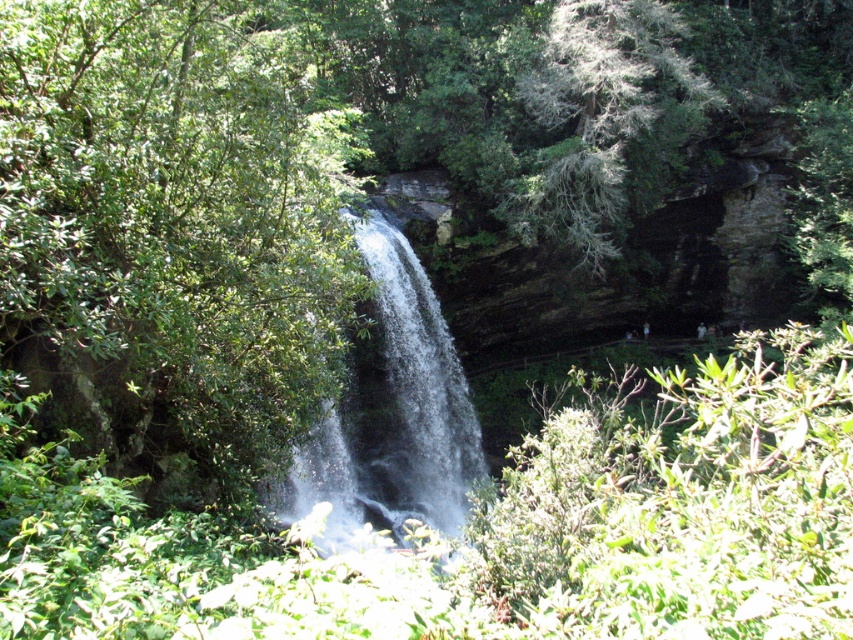
Question: Which point is closer to the camera taking this photo?

Choices:
 (A) (364, 516)
 (B) (170, 228)
 (C) (579, 161)

Answer: (B)

Question: Which of these objects is positioned closest to the green leafy tree at center?

Choices:
 (A) green textured rock at upper center
 (B) clear water at center

Answer: (B)

Question: Which object is the closest to the green textured rock at upper center?

Choices:
 (A) green leafy tree at center
 (B) clear water at center

Answer: (B)

Question: Is green leafy tree at center in front of green textured rock at upper center?

Choices:
 (A) no
 (B) yes

Answer: (B)

Question: Is green leafy tree at center closer to the viewer compared to green textured rock at upper center?

Choices:
 (A) no
 (B) yes

Answer: (B)

Question: Can you confirm if green leafy tree at center is smaller than green textured rock at upper center?

Choices:
 (A) no
 (B) yes

Answer: (A)